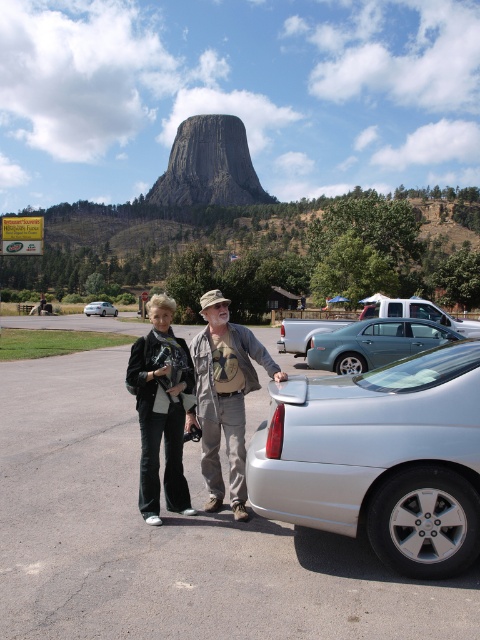
Between point (145, 413) and point (327, 317), which one is positioned behind?

Point (327, 317)

At what (x,y) coordinates should I click in order to perform the action: click on matte black jacket at center. Please return your answer as a coordinate pair (x, y). The width and height of the screenshot is (480, 640). Looking at the image, I should click on pos(162,404).

Which is more to the left, matte black jacket at center or metallic gray sedan at center?

matte black jacket at center

Can you confirm if matte black jacket at center is bigger than metallic gray sedan at center?

Incorrect, matte black jacket at center is not larger than metallic gray sedan at center.

Who is more distant from viewer, (180, 369) or (313, 344)?

Point (313, 344)

What are the coordinates of `matte black jacket at center` in the screenshot? It's located at (162, 404).

Can you confirm if silver metallic car at lower right is positioned to the right of matte black jacket at center?

Correct, you'll find silver metallic car at lower right to the right of matte black jacket at center.

Measure the distance between point (454, 358) and camera.

Point (454, 358) and camera are 15.27 feet apart from each other.

Where is `silver metallic car at lower right`? This screenshot has height=640, width=480. silver metallic car at lower right is located at coordinates (380, 458).